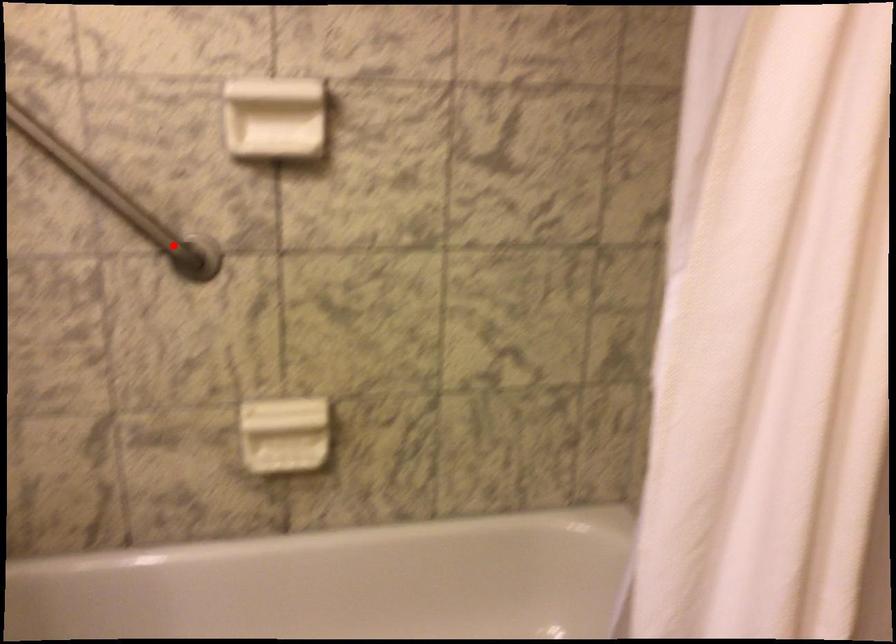
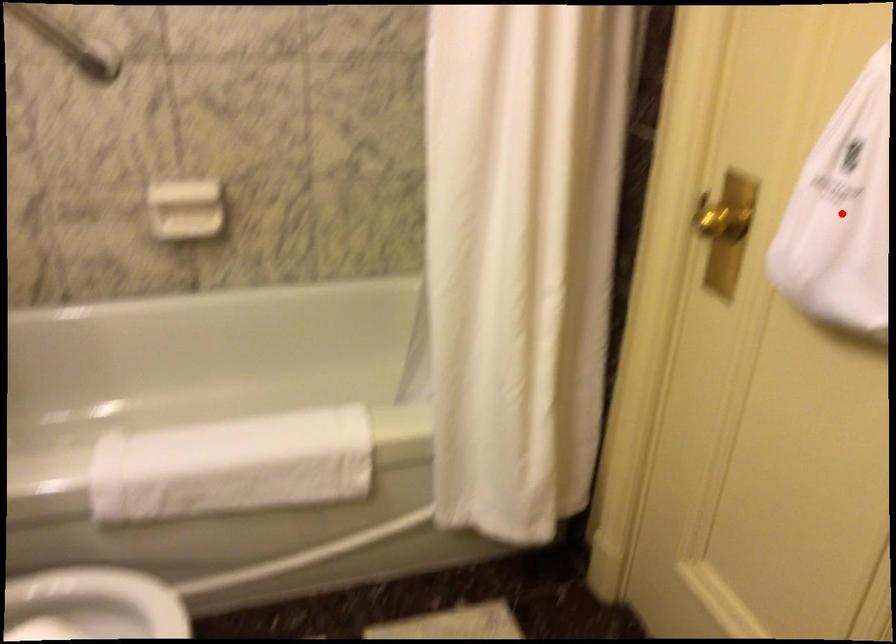
I am providing you with two images of the same scene from different viewpoints. A red point is marked on the first image and another point is marked on the second image. Is the red point in image1 aligned with the point shown in image2?

No